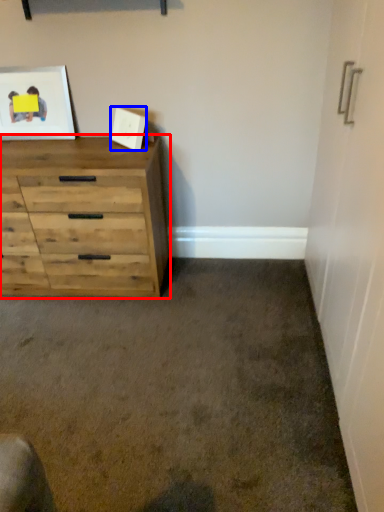
Question: Which object appears farthest to the camera in this image, chest of drawers (highlighted by a red box) or picture frame (highlighted by a blue box)?

Choices:
 (A) chest of drawers
 (B) picture frame

Answer: (B)